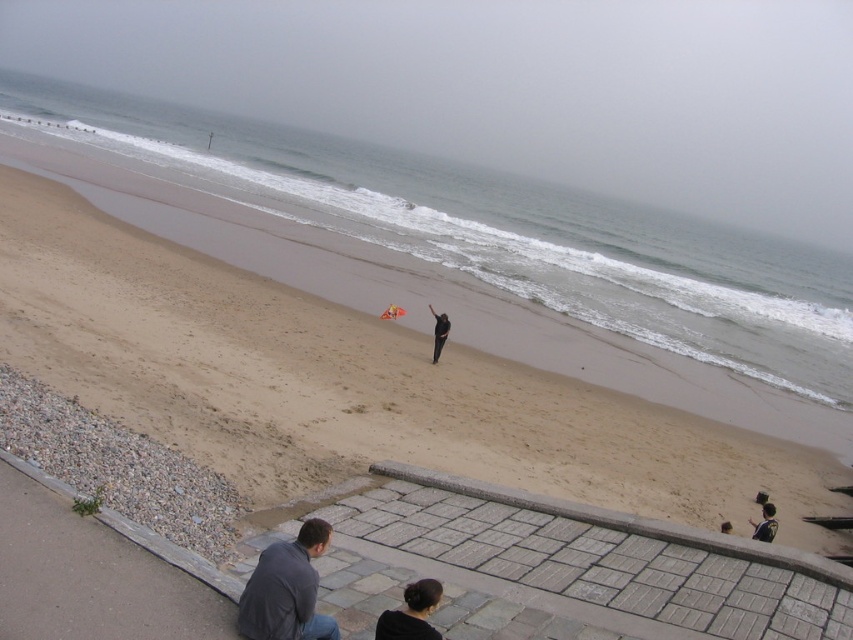
Question: Which point is farther from the camera taking this photo?

Choices:
 (A) (448, 323)
 (B) (730, 529)
 (C) (409, 600)

Answer: (A)

Question: Which point is farther to the camera?

Choices:
 (A) (387, 310)
 (B) (720, 524)
 (C) (772, 502)
 (D) (424, 625)

Answer: (A)

Question: Is black matte hair at lower center wider than dark gray fabric person at center?

Choices:
 (A) no
 (B) yes

Answer: (A)

Question: Which point appears farthest from the camera in this image?

Choices:
 (A) (438, 593)
 (B) (439, 342)
 (C) (273, 602)
 (D) (486, 349)

Answer: (D)

Question: In this image, where is dark gray fabric jacket at lower center located relative to orange fabric kite at center?

Choices:
 (A) left
 (B) right

Answer: (B)

Question: Is brown sandy beach at center smaller than orange fabric kite at center?

Choices:
 (A) yes
 (B) no

Answer: (B)